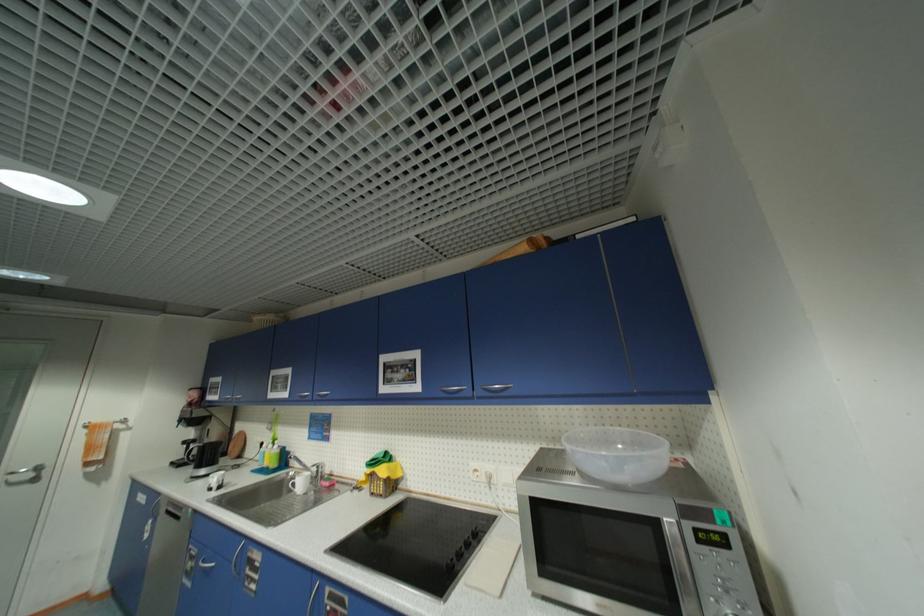
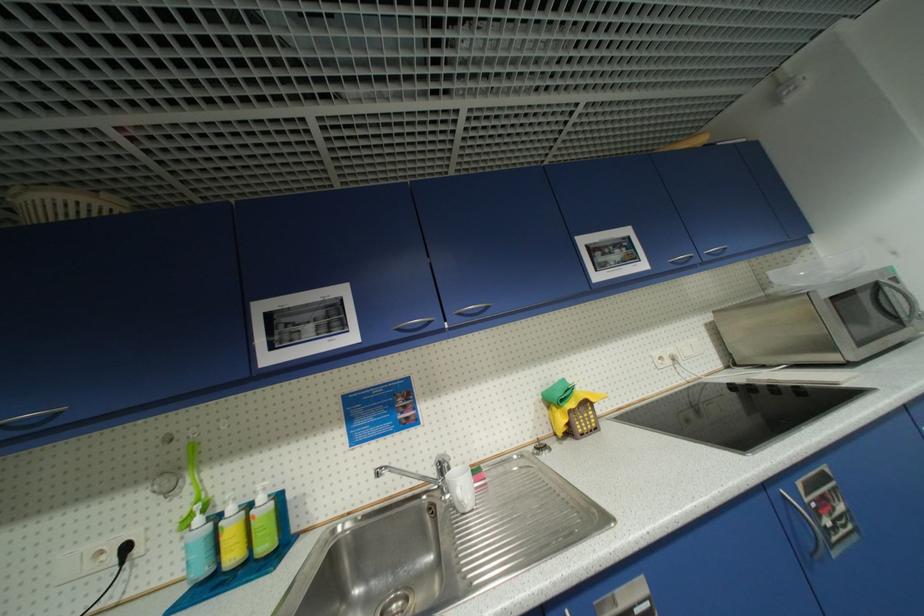
Where in the second image is the point corresponding to [282,448] from the first image?

(266, 500)